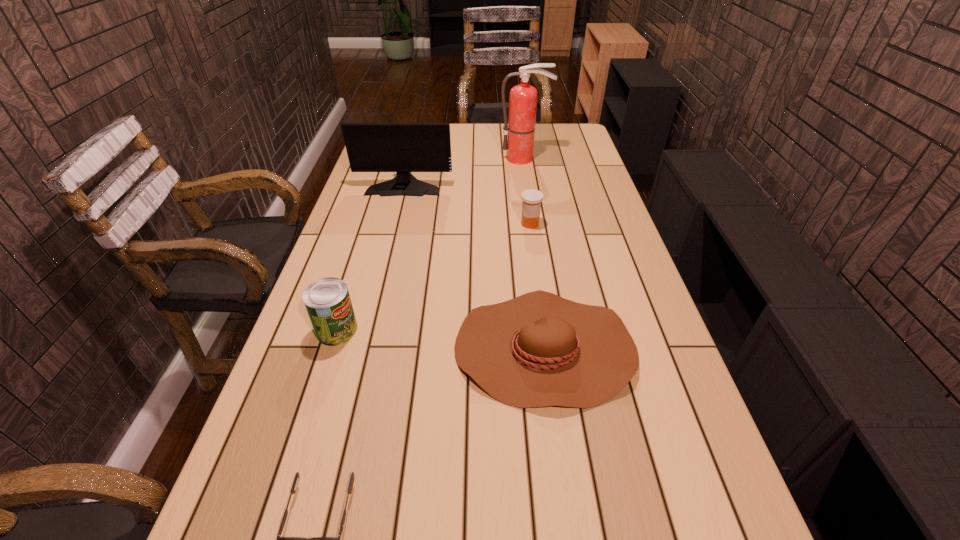
Find the location of `free location at the right edge of the desktop`. free location at the right edge of the desktop is located at coordinates (578, 151).

At what (x,y) coordinates should I click in order to perform the action: click on free region at the far right corner. Please return your answer as a coordinate pair (x, y). The image size is (960, 540). Looking at the image, I should click on coord(574,133).

The image size is (960, 540). I want to click on vacant area that lies between the fire extinguisher and the second farthest object, so click(x=464, y=172).

Where is `vacant region between the cowboy hat and the fourth shortest object`? The height and width of the screenshot is (540, 960). vacant region between the cowboy hat and the fourth shortest object is located at coordinates (442, 339).

Image resolution: width=960 pixels, height=540 pixels. I want to click on vacant area that lies between the fire extinguisher and the third tallest object, so click(x=430, y=244).

Find the location of a particular element. The image size is (960, 540). vacant space that is in between the third tallest object and the fifth nearest object is located at coordinates (371, 258).

You are a GUI agent. You are given a task and a screenshot of the screen. Output one action in this format:
    pyautogui.click(x=<x>, y=<y>)
    Task: Click on the vacant space that is in between the cowboy hat and the second farthest object
    The height and width of the screenshot is (540, 960).
    Given the screenshot: What is the action you would take?
    pyautogui.click(x=475, y=267)

Image resolution: width=960 pixels, height=540 pixels. What are the coordinates of `free space between the farthest object and the second farthest object` in the screenshot? It's located at (464, 172).

Where is `vacant space that's between the can and the farthest object`? This screenshot has height=540, width=960. vacant space that's between the can and the farthest object is located at coordinates (430, 244).

Image resolution: width=960 pixels, height=540 pixels. I want to click on object that stands as the fifth closest to the cowboy hat, so click(520, 128).